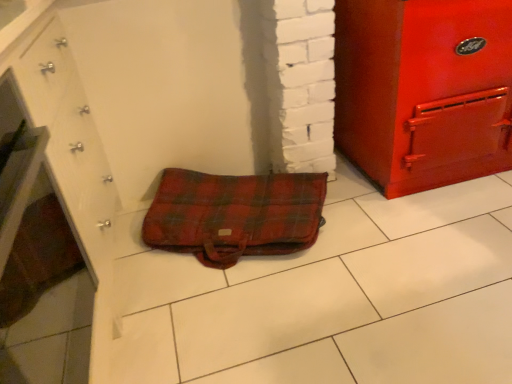
Measure the distance between plaid fabric bag at center and camera.

plaid fabric bag at center and camera are 1.51 meters apart from each other.

Where is `plaid fabric bag at center`? The height and width of the screenshot is (384, 512). plaid fabric bag at center is located at coordinates (234, 215).

Image resolution: width=512 pixels, height=384 pixels. What do you see at coordinates (234, 215) in the screenshot?
I see `plaid fabric bag at center` at bounding box center [234, 215].

Where is `plaid fabric bag at center`? Image resolution: width=512 pixels, height=384 pixels. plaid fabric bag at center is located at coordinates (234, 215).